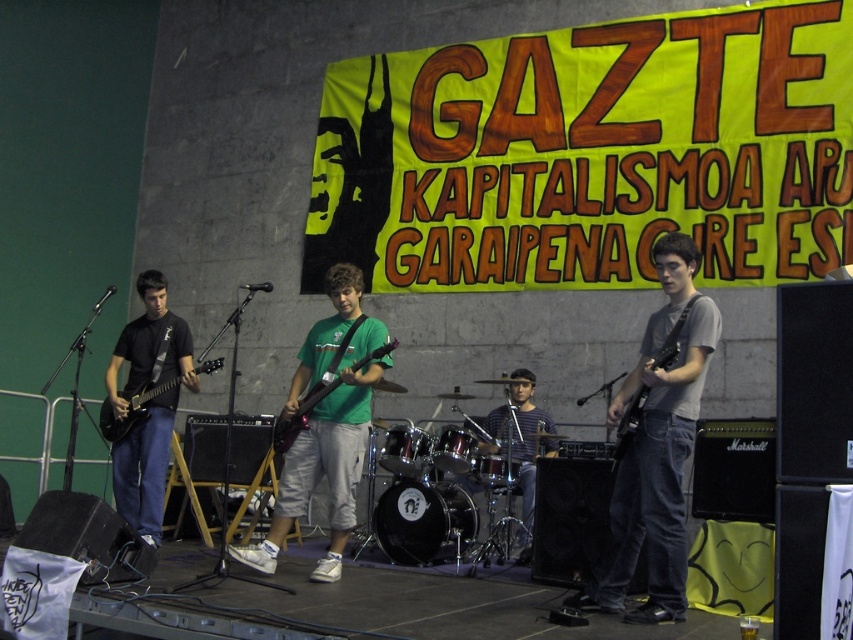
Question: Is green matte shirt at center to the right of matte black electric guitar at right from the viewer's perspective?

Choices:
 (A) yes
 (B) no

Answer: (B)

Question: Observing the image, what is the correct spatial positioning of green matte shirt at center in reference to matte black guitar at left?

Choices:
 (A) left
 (B) right

Answer: (B)

Question: Can you confirm if black matte electric guitar at left is positioned to the right of matte black electric guitar at center?

Choices:
 (A) yes
 (B) no

Answer: (B)

Question: Which point is closer to the camera taking this photo?

Choices:
 (A) (312, 474)
 (B) (662, 557)
 (C) (537, 408)
 (D) (143, 508)

Answer: (B)

Question: Based on their relative distances, which object is nearer to the matte black guitar at left?

Choices:
 (A) green matte shirt at center
 (B) shiny black guitar at center

Answer: (A)

Question: Among these points, which one is nearest to the camera?

Choices:
 (A) pyautogui.click(x=534, y=480)
 (B) pyautogui.click(x=347, y=385)
 (C) pyautogui.click(x=148, y=387)
 (D) pyautogui.click(x=584, y=604)

Answer: (D)